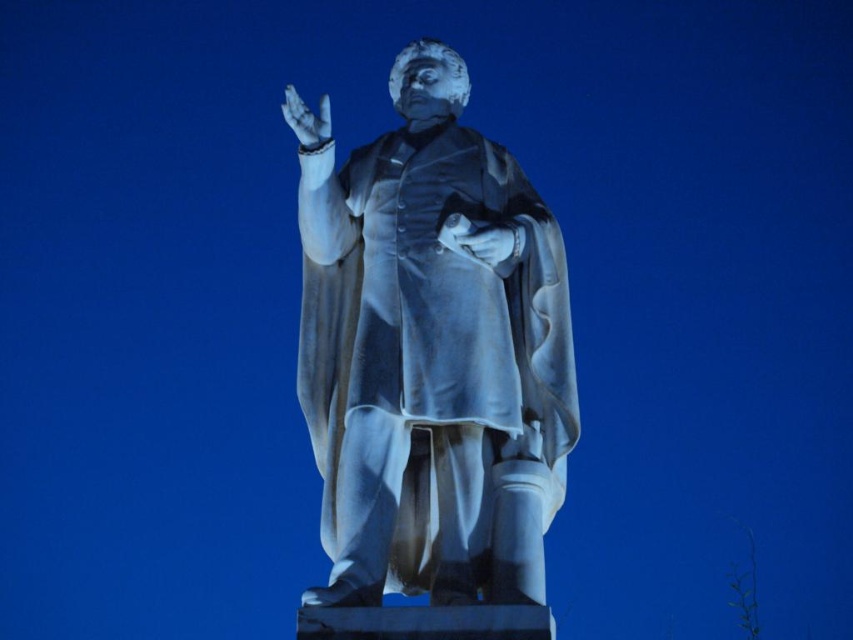
You are a sculptor who wants to place a small bronze plaque on the base of the white marble statue at center. The plaque requires a minimum of 1 meter of space between it and the white marble hand at upper center to avoid obstruction. Can you safely install the plaque at the base without violating this requirement?

The distance between the white marble statue at center and the white marble hand at upper center is 8.88 meters. Since the plaque needs only 1 meter of space, installing it at the base would easily meet the requirement as 8.88 meters is significantly larger than 1 meter.

You are a photographer trying to capture the statue in the image. You notice a specific point at coordinates point [480,241]. What object is located at this point?

The point [480,241] corresponds to the white marble glove at center.

You are an art restorer examining the statue. You need to place a protective covering over the white marble statue at center and the white marble glove at center. If the covering material can only cover up to the height of the shorter object, which object will remain partially exposed?

The white marble statue at center is much taller than the white marble glove at center, so the statue will remain partially exposed since the covering can only reach the height of the shorter glove.